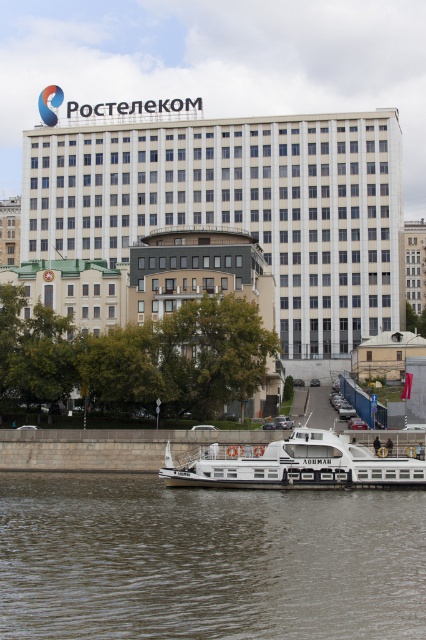
Can you confirm if brown water at lower center is positioned to the right of white glass building at upper center?

Correct, you'll find brown water at lower center to the right of white glass building at upper center.

Is brown water at lower center thinner than white glass building at upper center?

Yes, brown water at lower center is thinner than white glass building at upper center.

Is point (363, 570) more distant than point (244, 124)?

No, it is not.

Image resolution: width=426 pixels, height=640 pixels. I want to click on brown water at lower center, so click(207, 561).

Can you confirm if brown water at lower center is wider than white concrete building at center?

Yes, brown water at lower center is wider than white concrete building at center.

Is brown water at lower center above white concrete building at center?

No.

Who is more forward, (36, 596) or (408, 225)?

Point (36, 596) is more forward.

The width and height of the screenshot is (426, 640). What are the coordinates of `brown water at lower center` in the screenshot? It's located at (207, 561).

Is point (210, 145) farther from viewer compared to point (423, 296)?

No, (210, 145) is closer to viewer.

Is point (173, 198) less distant than point (414, 275)?

Yes, point (173, 198) is in front of point (414, 275).

Where is `white glass building at upper center`? This screenshot has height=640, width=426. white glass building at upper center is located at coordinates (233, 204).